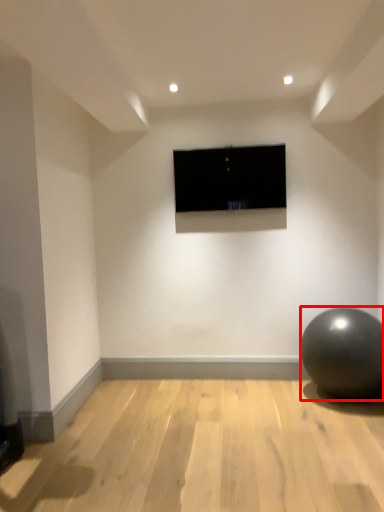
Question: From the image's perspective, what is the correct spatial relationship of ball (annotated by the red box) in relation to television?

Choices:
 (A) below
 (B) above

Answer: (A)